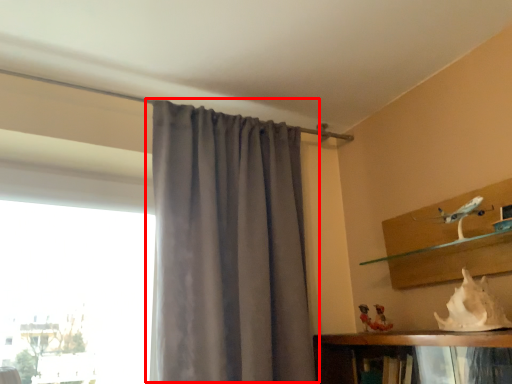
Question: From the image, what is the correct spatial relationship of curtain (annotated by the red box) in relation to animal?

Choices:
 (A) right
 (B) left

Answer: (B)